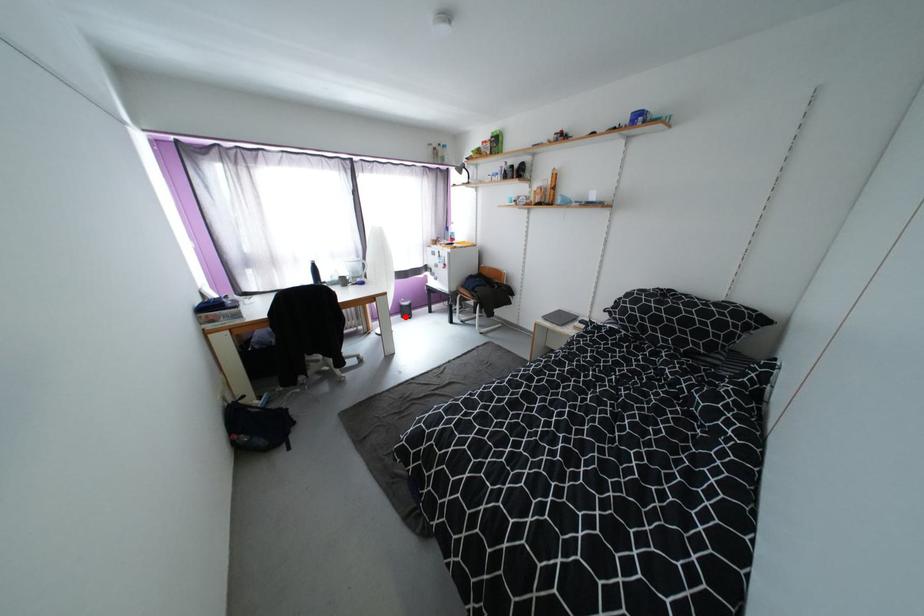
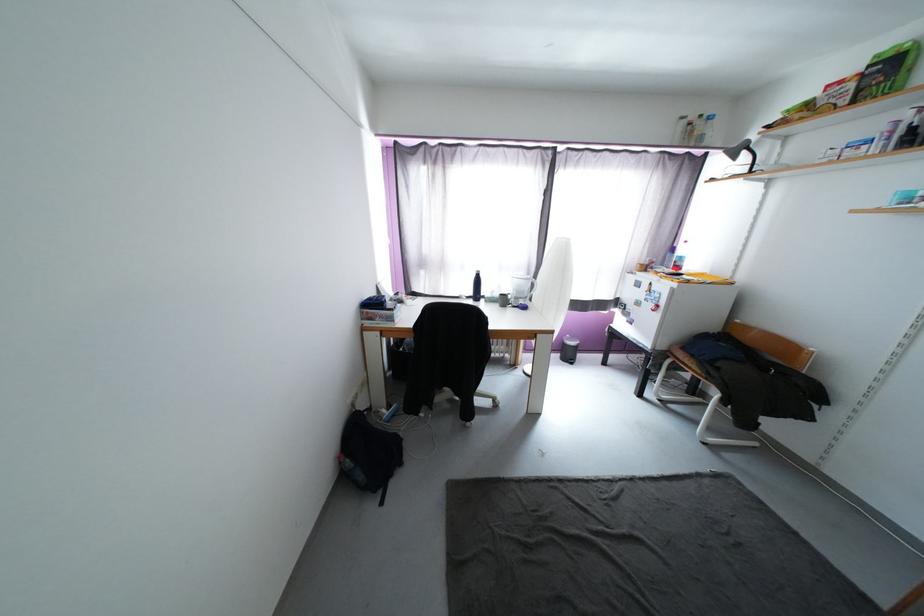
Question: I am providing you with two images of the same scene from different viewpoints. Image1 has a red point marked. In image2, the corresponding 3D location appears at what relative position? Reply with the corresponding letter.

Choices:
 (A) Closer
 (B) Farther

Answer: (B)